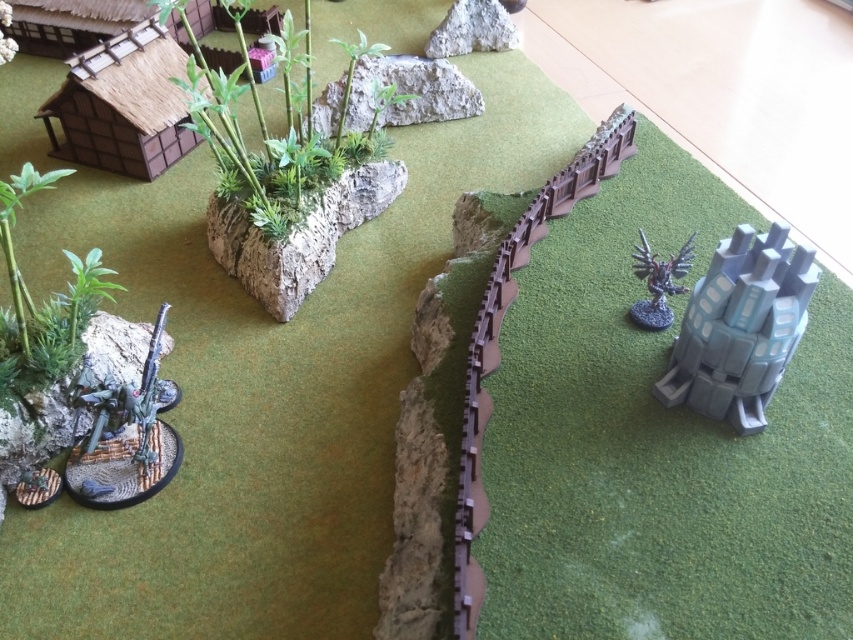
You are a player in a tabletop game and need to determine if your miniature figure, which is 3 feet tall, can see over the rough concrete rock at upper center from where you are standing. Can it?

The rough concrete rock at upper center and camera are 5.72 feet apart. Since the figure is 3 feet tall, it may not be able to see over the rock if the rock is taller than 3 feet. However, the description does not specify the rock height, so visibility cannot be determined with certainty.

You are a player in a tabletop game trying to move your character from the gray stone at center to the metallic silver sword at lower left. Can you reach the sword without stepping off the game board? Explain your reasoning based on their positions.

The gray stone at center is above the metallic silver sword at lower left, so moving downward from the gray stone at center to the metallic silver sword at lower left would be possible without leaving the game board since they are vertically aligned.

You are a player in a tabletop game and need to place a new miniature figure on the game board. The game rules state that the figure must be placed exactly at the coordinates provided for the rough concrete rock at upper center. What are the coordinates where you should place your figure?

The coordinates for the rough concrete rock at upper center are at point [410,92], so you should place your figure there.